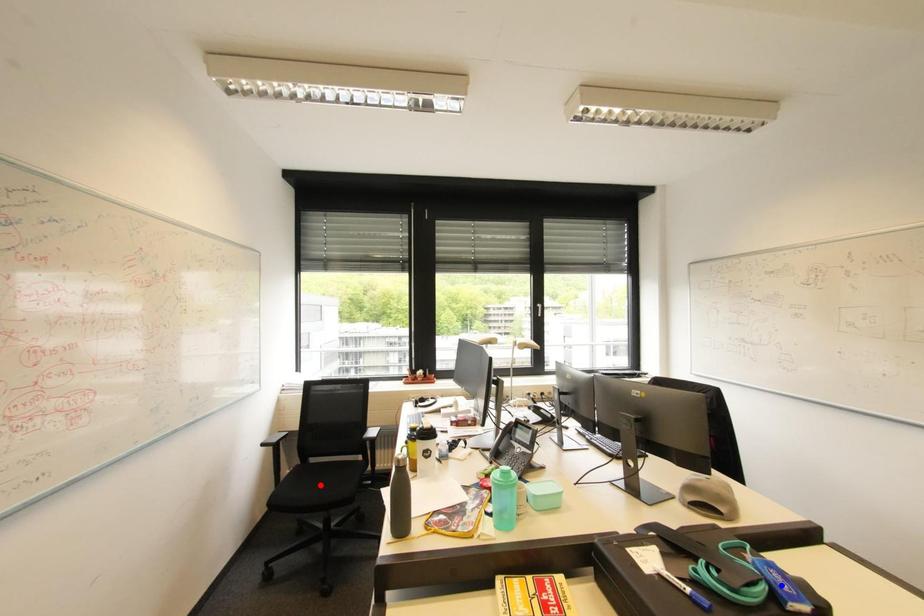
Question: In the image, two points are highlighted. Which point is nearer to the camera? Reply with the corresponding letter.

Choices:
 (A) blue point
 (B) red point

Answer: (A)